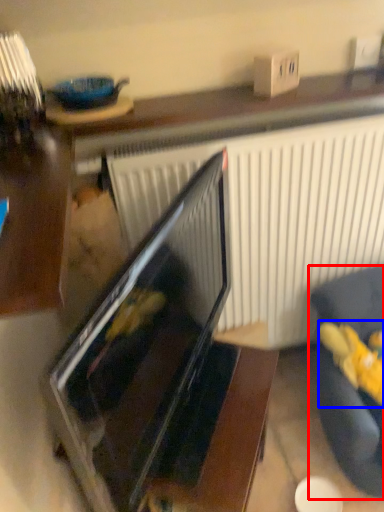
Question: Which of the following is the closest to the observer, furniture (highlighted by a red box) or stuff (highlighted by a blue box)?

Choices:
 (A) furniture
 (B) stuff

Answer: (A)